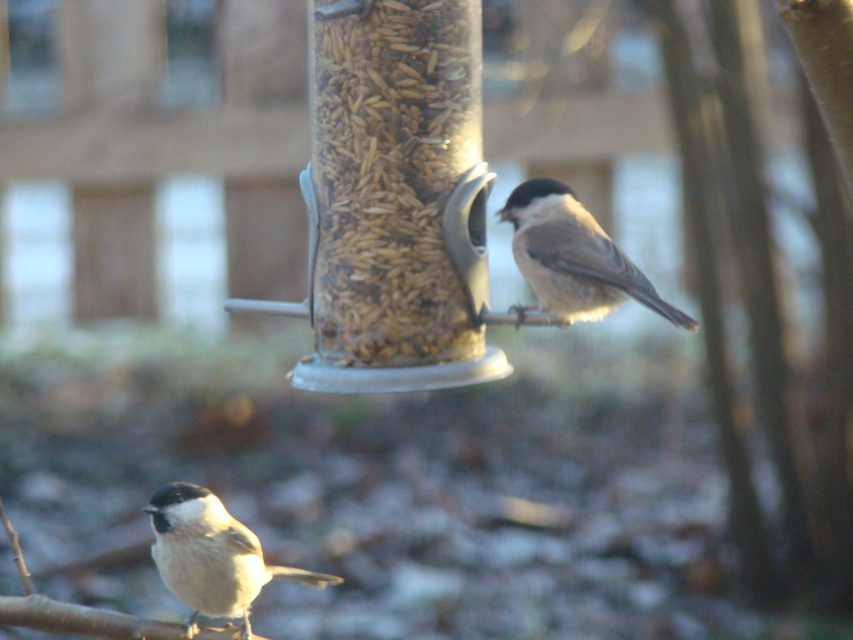
You are a photographer aiming to capture a closeup of the brown grain at center and the soft gray feathers at upper right in the image. Based on their positions, which one would appear larger in your photo?

The brown grain at center appears larger in the photo because it is closer to the viewer than the soft gray feathers at upper right.

You are a bird flying towards the bird feeder in the image. You see the brown grain at center and the soft gray feathers at lower left. Which object is closer to the ground?

The soft gray feathers at lower left are closer to the ground since the brown grain at center is located above them.